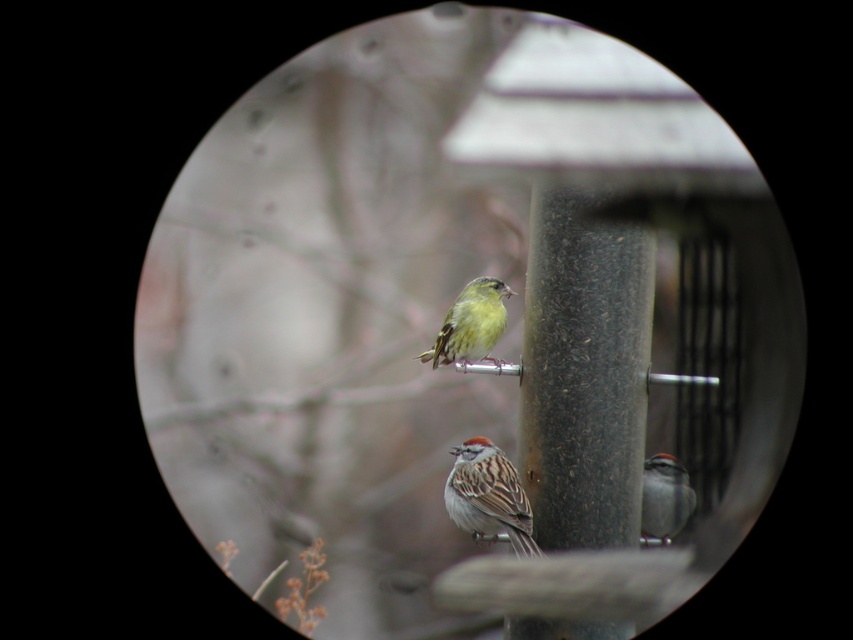
Question: Does yellow-green textured bird at center have a greater width compared to gray matte sparrow at lower right?

Choices:
 (A) no
 (B) yes

Answer: (B)

Question: From the image, what is the correct spatial relationship of brown speckled sparrow at lower center in relation to gray matte sparrow at lower right?

Choices:
 (A) left
 (B) right

Answer: (A)

Question: Among these points, which one is nearest to the camera?

Choices:
 (A) (647, 500)
 (B) (463, 320)
 (C) (467, 440)

Answer: (B)

Question: Estimate the real-world distances between objects in this image. Which object is farther from the brown speckled sparrow at lower center?

Choices:
 (A) gray matte sparrow at lower right
 (B) yellow-green textured bird at center

Answer: (A)

Question: Does brown speckled sparrow at lower center appear on the left side of yellow-green textured bird at center?

Choices:
 (A) yes
 (B) no

Answer: (B)

Question: Which point is closer to the camera?

Choices:
 (A) (457, 326)
 (B) (459, 515)
 (C) (647, 486)

Answer: (B)